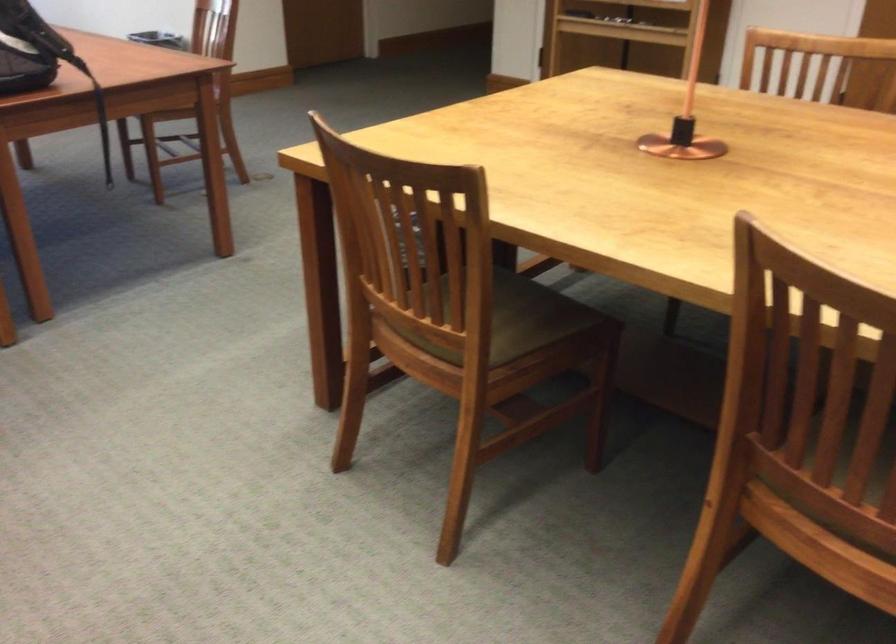
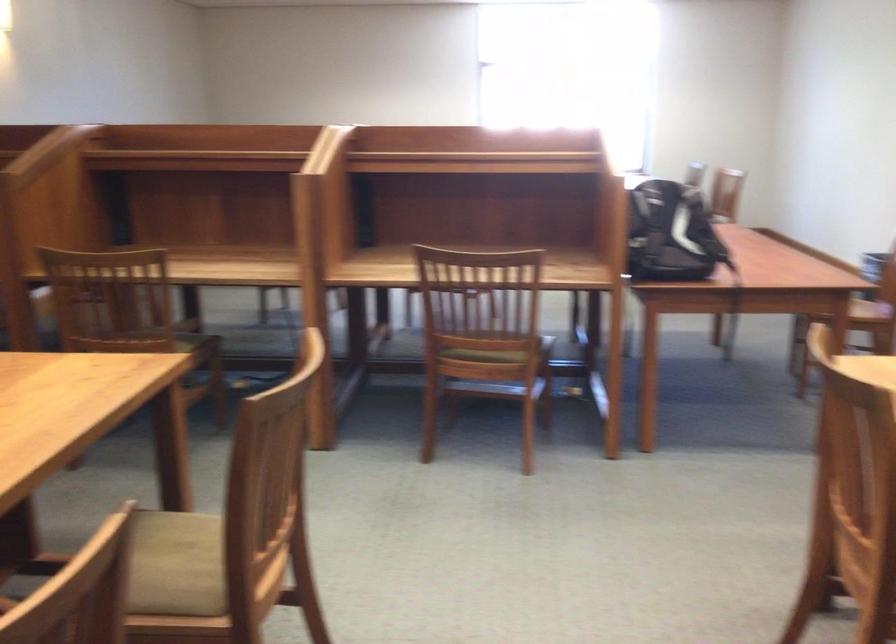
Question: How did the camera likely rotate?

Choices:
 (A) Left
 (B) Right
 (C) Up
 (D) Down

Answer: (A)